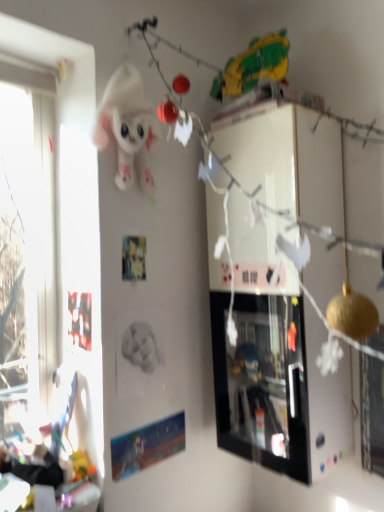
Question: Is white plush toy at upper center inside the boundaries of black glossy picture frame at upper center, or outside?

Choices:
 (A) outside
 (B) inside

Answer: (A)

Question: Visually, is white plush toy at upper center positioned to the left or to the right of black glossy picture frame at upper center?

Choices:
 (A) left
 (B) right

Answer: (A)

Question: From a real-world perspective, is white plush toy at upper center positioned above or below black glossy picture frame at upper center?

Choices:
 (A) above
 (B) below

Answer: (A)

Question: Is black glossy picture frame at upper center inside the boundaries of white plush toy at upper center, or outside?

Choices:
 (A) outside
 (B) inside

Answer: (A)

Question: Is black glossy picture frame at upper center in front of or behind white plush toy at upper center in the image?

Choices:
 (A) behind
 (B) front

Answer: (A)

Question: Is black glossy picture frame at upper center wider or thinner than white plush toy at upper center?

Choices:
 (A) thin
 (B) wide

Answer: (B)

Question: Considering the positions of point [223, 395] and point [117, 108], is point [223, 395] closer or farther from the camera than point [117, 108]?

Choices:
 (A) closer
 (B) farther

Answer: (B)